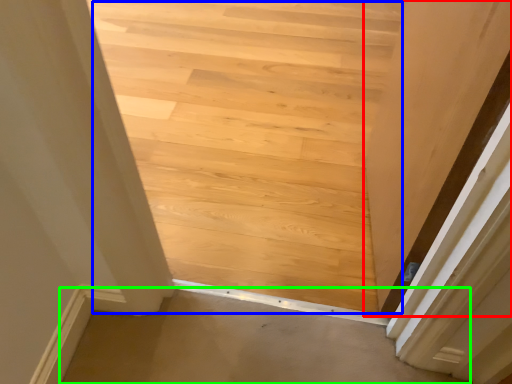
Question: Which object is the farthest from door (highlighted by a red box)? Choose among these: stairwell (highlighted by a blue box) or plain (highlighted by a green box).

Choices:
 (A) stairwell
 (B) plain

Answer: (A)